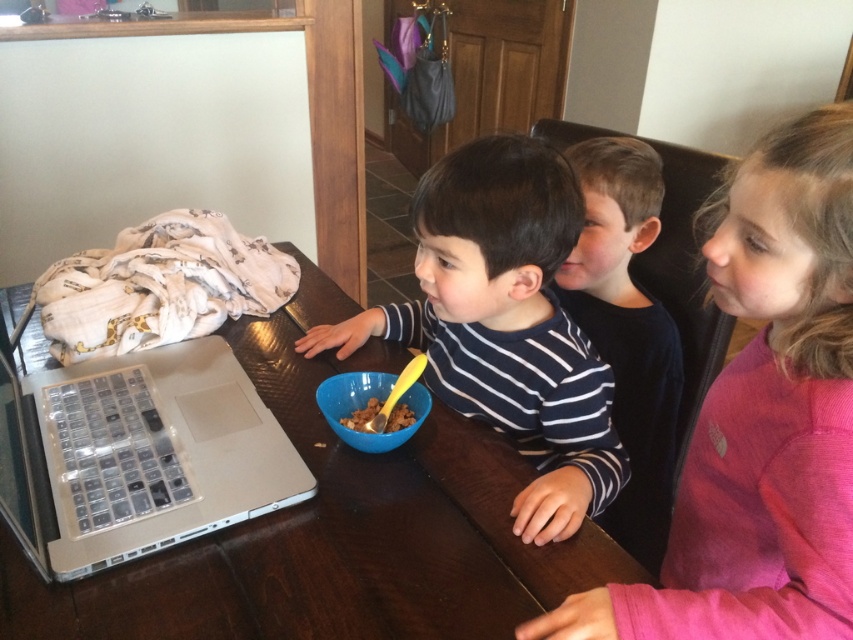
Describe the element at coordinates (335, 529) in the screenshot. I see `brown wooden table at center` at that location.

Is brown wooden table at center below pink cotton shirt at upper right?

Indeed, brown wooden table at center is positioned under pink cotton shirt at upper right.

Is point (341, 484) positioned before point (846, 620)?

That is False.

Find the location of a particular element. This screenshot has width=853, height=640. brown wooden table at center is located at coordinates [x=335, y=529].

Who is shorter, pink cotton shirt at upper right or brown crumbly cereal at center?

brown crumbly cereal at center is shorter.

Identify the location of pink cotton shirt at upper right. (761, 417).

What are the coordinates of `pink cotton shirt at upper right` in the screenshot? It's located at (761, 417).

Is dark blue striped shirt at center smaller than blue plastic bowl at center?

No, dark blue striped shirt at center is not smaller than blue plastic bowl at center.

Can you confirm if dark blue striped shirt at center is positioned to the right of blue plastic bowl at center?

Indeed, dark blue striped shirt at center is positioned on the right side of blue plastic bowl at center.

Who is more forward, (650, 305) or (358, 381)?

Point (358, 381) is in front.

The width and height of the screenshot is (853, 640). In order to click on dark blue striped shirt at center in this screenshot , I will do pos(627,330).